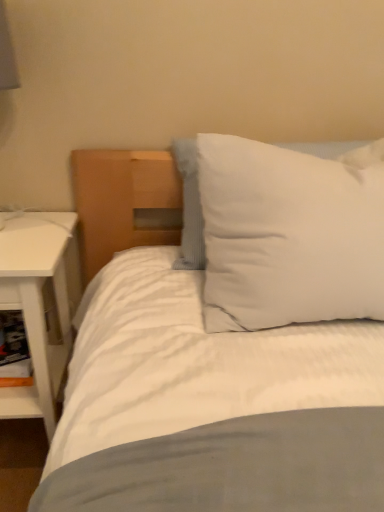
Question: Is point (11, 216) closer or farther from the camera than point (377, 245)?

Choices:
 (A) closer
 (B) farther

Answer: (B)

Question: Which is correct: white matte nightstand at left is inside white soft pillow at upper right, or outside of it?

Choices:
 (A) inside
 (B) outside

Answer: (B)

Question: Which is nearer to the white cardboard shelf at lower left?

Choices:
 (A) white soft pillow at upper right
 (B) white matte nightstand at left

Answer: (B)

Question: Which of these objects is positioned farthest from the white matte nightstand at left?

Choices:
 (A) white cardboard shelf at lower left
 (B) white soft pillow at upper right

Answer: (B)